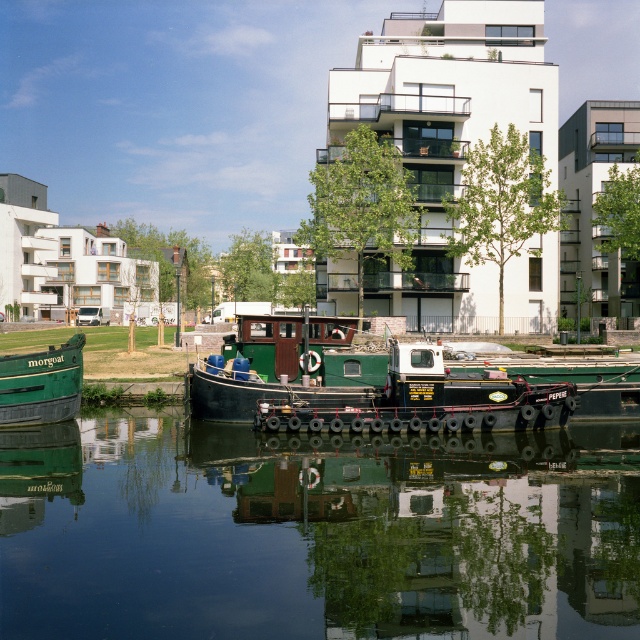
Question: Among these objects, which one is nearest to the camera?

Choices:
 (A) green matte barge at center
 (B) green matte barge at lower left

Answer: (A)

Question: Is black rubber water at center to the left of green matte barge at center from the viewer's perspective?

Choices:
 (A) yes
 (B) no

Answer: (B)

Question: Is green matte barge at center positioned at the back of green matte barge at lower left?

Choices:
 (A) yes
 (B) no

Answer: (B)

Question: Is black rubber water at center to the right of green matte barge at lower left from the viewer's perspective?

Choices:
 (A) yes
 (B) no

Answer: (A)

Question: Which of the following is the farthest from the observer?

Choices:
 (A) black rubber water at center
 (B) green matte barge at lower left
 (C) green matte barge at center

Answer: (B)

Question: Among these objects, which one is nearest to the camera?

Choices:
 (A) green matte barge at lower left
 (B) black rubber water at center

Answer: (B)